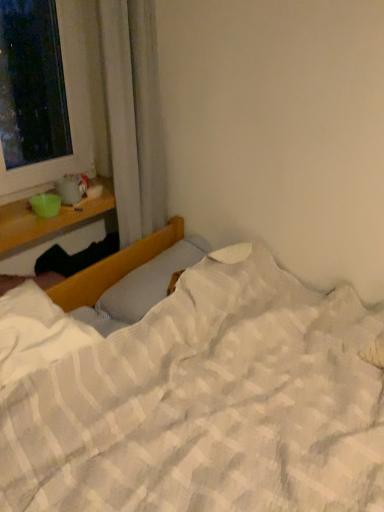
Identify the location of free point above white textured pillow at center (from a real-world perspective). The height and width of the screenshot is (512, 384). (165, 270).